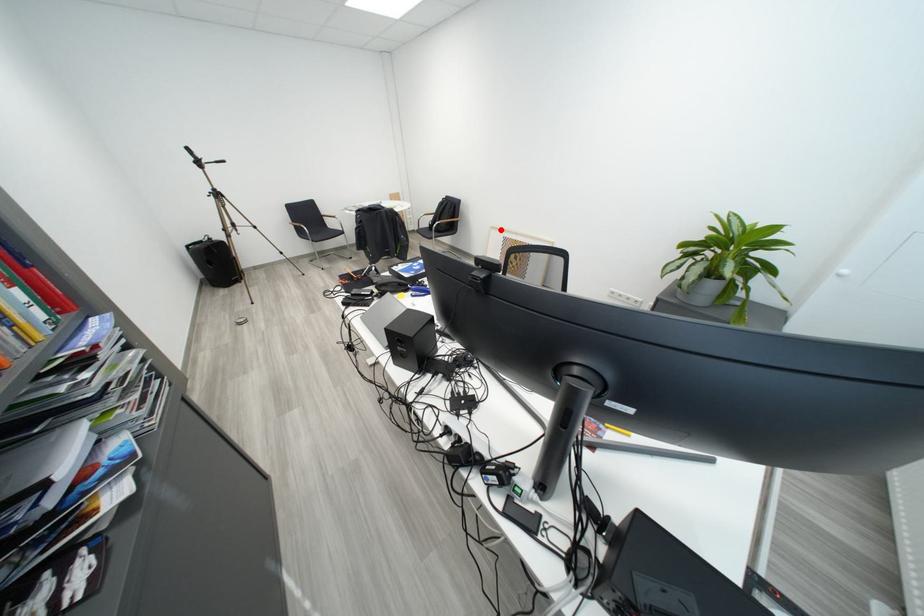
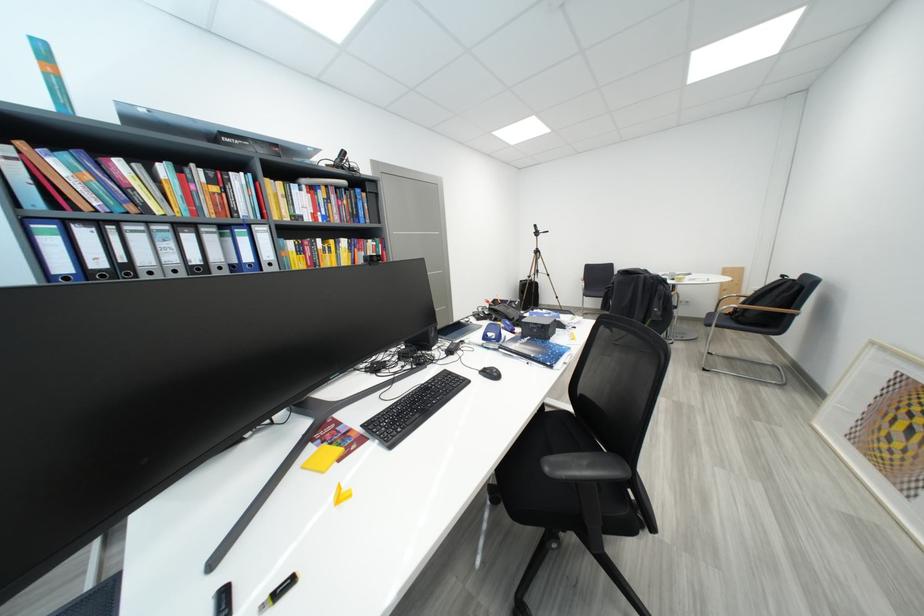
The point at the highlighted location is marked in the first image. Where is the corresponding point in the second image?

(881, 346)